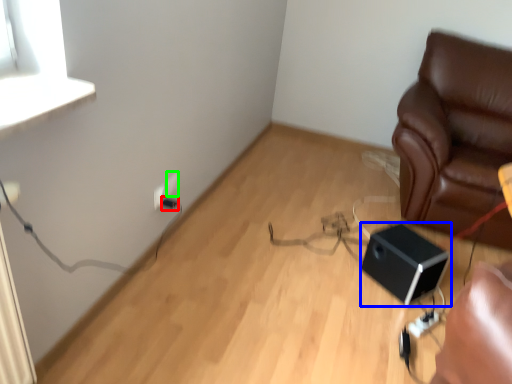
Question: Based on their relative distances, which object is farther from electric outlet (highlighted by a red box)? Choose from speaker (highlighted by a blue box) and electric outlet (highlighted by a green box).

Choices:
 (A) speaker
 (B) electric outlet

Answer: (A)